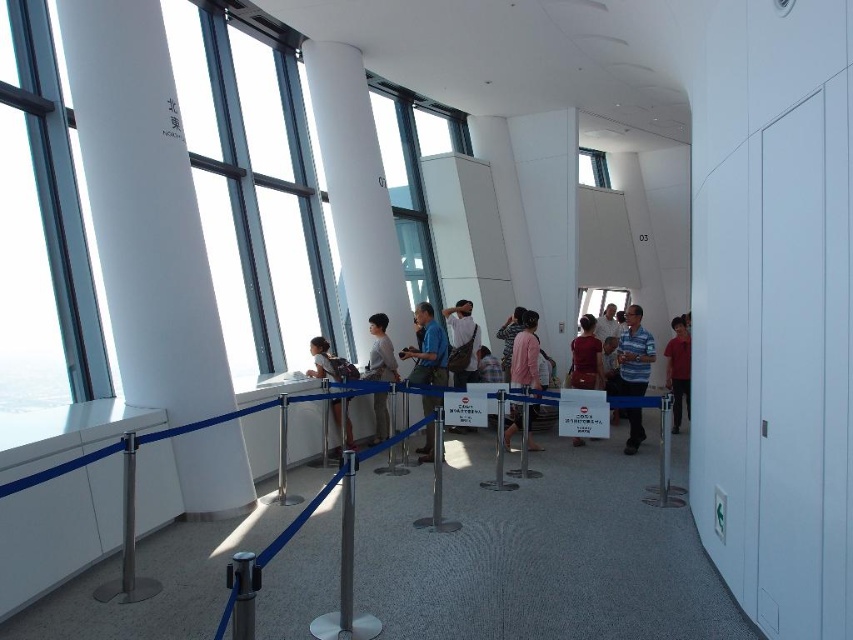
Question: Is silver metallic barrier at center in front of matte red shirt at center-right?

Choices:
 (A) no
 (B) yes

Answer: (B)

Question: Which object appears farthest from the camera in this image?

Choices:
 (A) matte red shirt at center-right
 (B) matte brown bag at center

Answer: (A)

Question: Which of the following is the farthest from the observer?

Choices:
 (A) blue fabric shirt at center
 (B) matte black backpack at center
 (C) blue striped shirt at center

Answer: (C)

Question: Does white smooth column at center have a smaller size compared to matte red shirt at center?

Choices:
 (A) yes
 (B) no

Answer: (B)

Question: Observing the image, what is the correct spatial positioning of matte red shirt at center-right in reference to matte black backpack at center?

Choices:
 (A) left
 (B) right

Answer: (B)

Question: Which of the following is the closest to the observer?

Choices:
 (A) white smooth column at center
 (B) matte brown bag at center
 (C) white smooth pillar at left

Answer: (C)